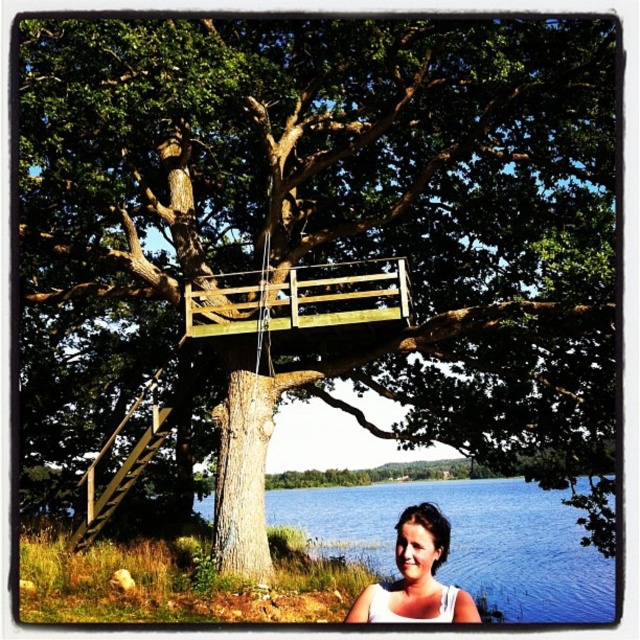
You are standing on the ground and looking at the wooden at upper center and the wooden at left. Which one is nearer to you?

The wooden at upper center is closer to the viewer than wooden at left.

You are planning to place a small garden ornament on the wooden at upper center and the wooden at left. Which location is higher from the ground?

The wooden at upper center is located above the wooden at left, so the wooden at upper center is higher from the ground.